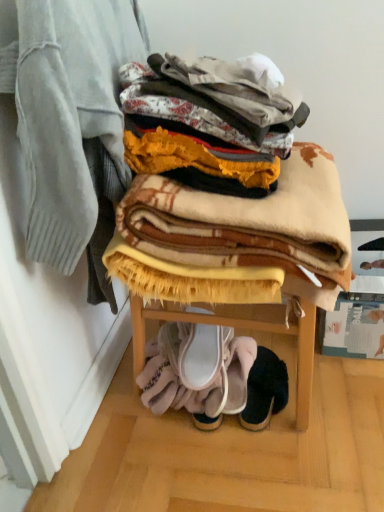
Question: From the image's perspective, is beige woolen blanket at center, which appears as the 2th blanket when viewed from the left, above white fabric slipper at lower center, the first footwear from the left?

Choices:
 (A) yes
 (B) no

Answer: (A)

Question: Would you say beige woolen blanket at center, which appears as the 2th blanket when viewed from the left, is outside white fabric slipper at lower center, positioned as the third footwear in right-to-left order?

Choices:
 (A) no
 (B) yes

Answer: (B)

Question: Is beige woolen blanket at center, the first blanket in the right-to-left sequence, next to white fabric slipper at lower center, the first footwear from the left, and touching it?

Choices:
 (A) yes
 (B) no

Answer: (B)

Question: Is beige woolen blanket at center, the first blanket in the right-to-left sequence, to the left of white fabric slipper at lower center, positioned as the third footwear in right-to-left order, from the viewer's perspective?

Choices:
 (A) yes
 (B) no

Answer: (B)

Question: From the image's perspective, would you say beige woolen blanket at center, the first blanket in the right-to-left sequence, is shown under white fabric slipper at lower center, positioned as the third footwear in right-to-left order?

Choices:
 (A) no
 (B) yes

Answer: (A)

Question: Is beige woolen blanket at center, which appears as the 2th blanket when viewed from the left, thinner than white fabric slipper at lower center, the first footwear from the left?

Choices:
 (A) no
 (B) yes

Answer: (A)

Question: Is plaid wool blanket at upper center, arranged as the first blanket when viewed from the left, at the right side of white fabric slipper at lower center, the 2th footwear positioned from the right?

Choices:
 (A) no
 (B) yes

Answer: (A)

Question: Does plaid wool blanket at upper center, arranged as the first blanket when viewed from the left, have a lesser height compared to white fabric slipper at lower center, the 2th footwear positioned from the right?

Choices:
 (A) no
 (B) yes

Answer: (A)

Question: Considering the relative sizes of plaid wool blanket at upper center, which is counted as the second blanket, starting from the right, and white fabric slipper at lower center, acting as the second footwear starting from the left, in the image provided, is plaid wool blanket at upper center, which is counted as the second blanket, starting from the right, bigger than white fabric slipper at lower center, acting as the second footwear starting from the left,?

Choices:
 (A) yes
 (B) no

Answer: (A)

Question: Does plaid wool blanket at upper center, which is counted as the second blanket, starting from the right, have a smaller size compared to white fabric slipper at lower center, acting as the second footwear starting from the left?

Choices:
 (A) no
 (B) yes

Answer: (A)

Question: Could you tell me if plaid wool blanket at upper center, which is counted as the second blanket, starting from the right, is turned towards white fabric slipper at lower center, acting as the second footwear starting from the left?

Choices:
 (A) no
 (B) yes

Answer: (A)

Question: Is plaid wool blanket at upper center, arranged as the first blanket when viewed from the left, further to camera compared to white fabric slipper at lower center, acting as the second footwear starting from the left?

Choices:
 (A) yes
 (B) no

Answer: (B)

Question: Can you confirm if white fabric slipper at lower center, positioned as the third footwear in right-to-left order, is bigger than beige woolen blanket at center, which appears as the 2th blanket when viewed from the left?

Choices:
 (A) yes
 (B) no

Answer: (B)